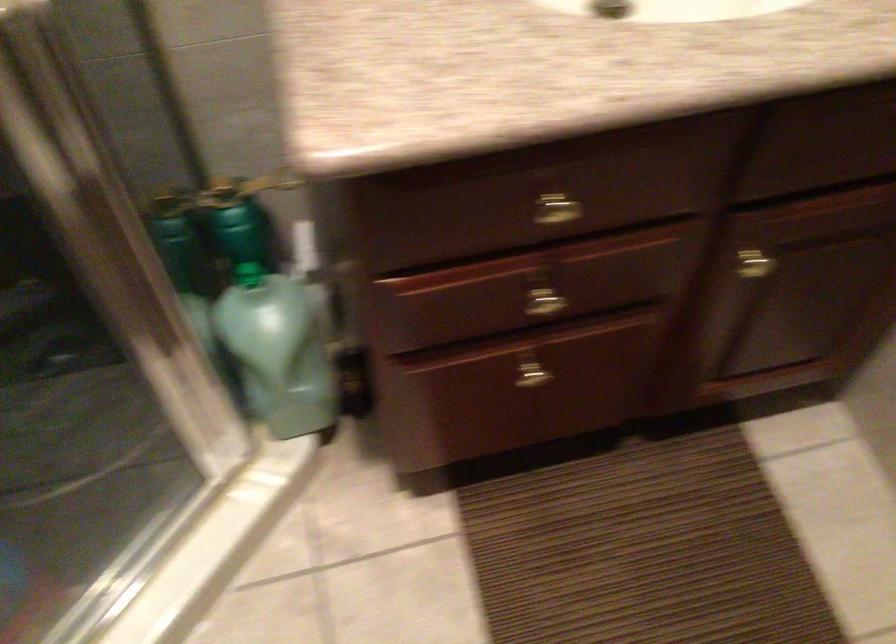
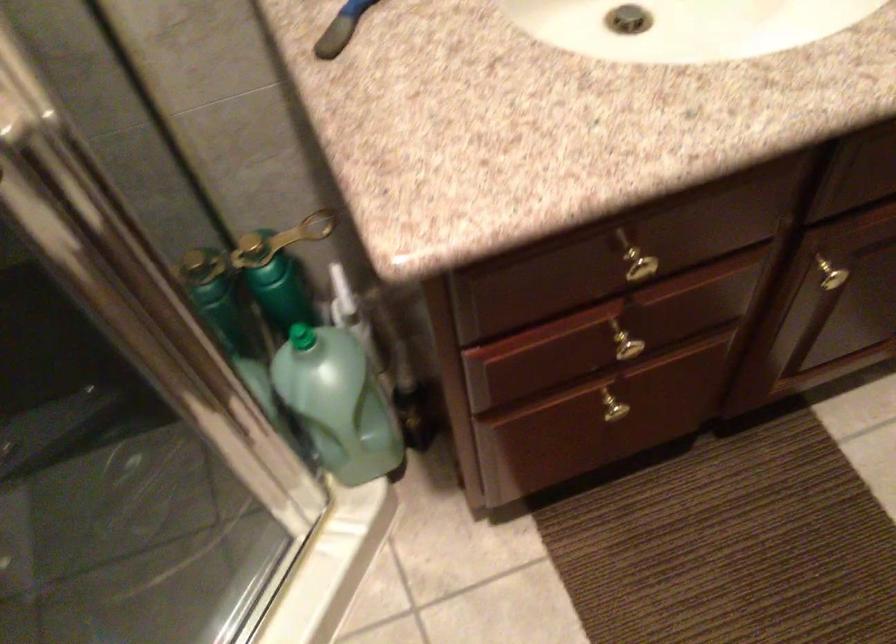
Locate, in the second image, the point that corresponds to (x=271, y=346) in the first image.

(338, 402)